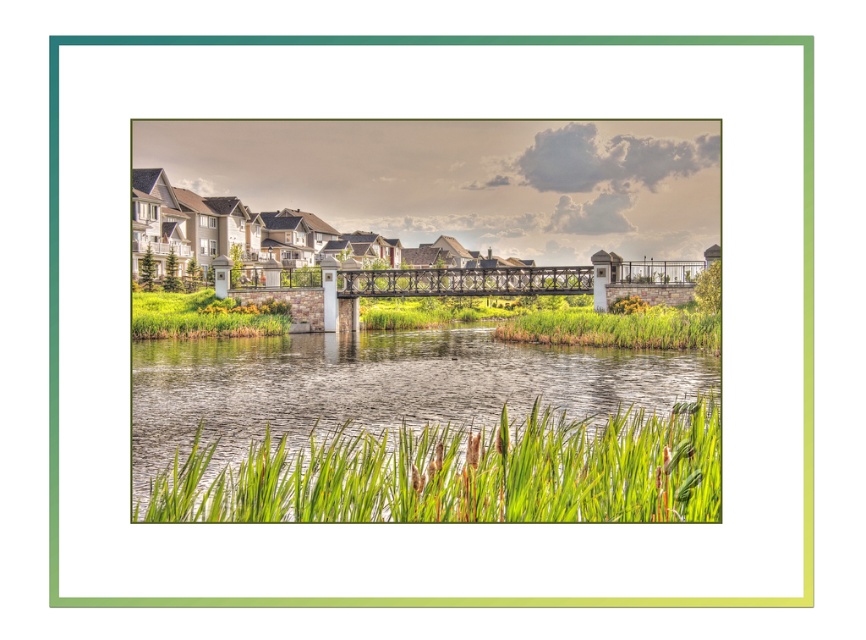
Question: In this image, where is green leafy grass at lower center located relative to green grass at center?

Choices:
 (A) above
 (B) below

Answer: (B)

Question: Can you confirm if green grass at center is positioned below green grass at lower left?

Choices:
 (A) no
 (B) yes

Answer: (B)

Question: Is green leafy grass at lower center positioned before green grass at lower left?

Choices:
 (A) yes
 (B) no

Answer: (A)

Question: Among these points, which one is farthest from the camera?

Choices:
 (A) (531, 275)
 (B) (706, 396)
 (C) (579, 312)

Answer: (A)

Question: Estimate the real-world distances between objects in this image. Which object is closer to the metallic bridge at center?

Choices:
 (A) green leafy grass at lower center
 (B) green grass at lower left

Answer: (B)

Question: Among these points, which one is nearest to the camera?

Choices:
 (A) (625, 336)
 (B) (221, 330)
 (C) (461, 289)

Answer: (A)